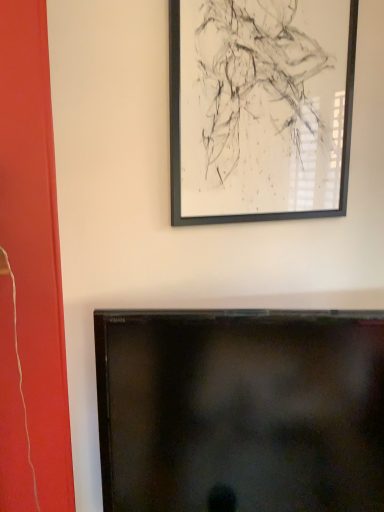
The image size is (384, 512). What do you see at coordinates (260, 109) in the screenshot? I see `black matte picture frame at upper center` at bounding box center [260, 109].

In order to face black matte picture frame at upper center, should I rotate leftwards or rightwards?

You should rotate right by 10.888 degrees.

You are a GUI agent. You are given a task and a screenshot of the screen. Output one action in this format:
    pyautogui.click(x=<x>, y=<y>)
    Task: Click on the black matte picture frame at upper center
    Image resolution: width=384 pixels, height=512 pixels.
    Given the screenshot: What is the action you would take?
    pyautogui.click(x=260, y=109)

What is the approximate width of black matte picture frame at upper center?

black matte picture frame at upper center is 1.94 inches in width.

Where is `black matte picture frame at upper center`? This screenshot has height=512, width=384. black matte picture frame at upper center is located at coordinates 260,109.